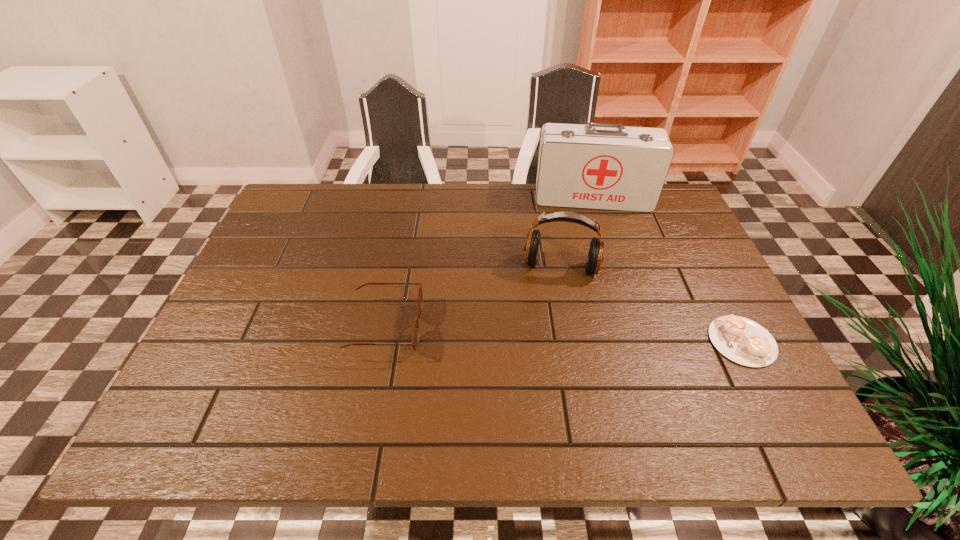
Find the location of `vacant space that's between the headset and the tallest object`. vacant space that's between the headset and the tallest object is located at coordinates (577, 233).

Where is `unoccupied area between the headset and the third tallest object`? This screenshot has width=960, height=540. unoccupied area between the headset and the third tallest object is located at coordinates (473, 298).

Where is `unoccupied position between the leftmost object and the cappuccino`? unoccupied position between the leftmost object and the cappuccino is located at coordinates (564, 334).

The image size is (960, 540). Identify the location of free spot between the third tallest object and the shortest object. (564, 334).

At what (x,y) coordinates should I click in order to perform the action: click on empty space between the spectacles and the cappuccino. Please return your answer as a coordinate pair (x, y). The width and height of the screenshot is (960, 540). Looking at the image, I should click on (564, 334).

In order to click on free space between the tallest object and the shortest object in this screenshot , I will do `click(667, 270)`.

Identify the location of vacant region between the first-aid kit and the shortest object. (667, 270).

Identify the location of object that is the nearest to the cappuccino. Image resolution: width=960 pixels, height=540 pixels. coord(595,256).

Choose which object is the nearest neighbor to the first-aid kit. Please provide its 2D coordinates. Your answer should be formatted as a tuple, i.e. [(x, y)], where the tuple contains the x and y coordinates of a point satisfying the conditions above.

[(595, 256)]